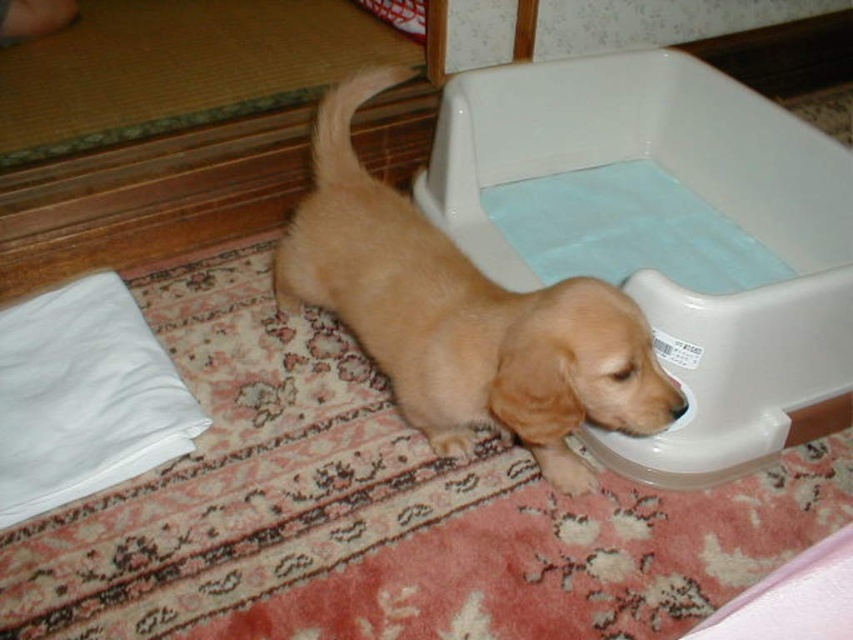
You need to place a toy that is 1.2 meters long in the space between the white plastic tub at lower right and the golden fur dog at center. Based on the scene, can the toy fit horizontally in that space?

The white plastic tub at lower right might be wider than golden fur dog at center, so the space between them may not be wide enough to fit a 1.2 meter long toy horizontally.

You are a delivery person with a package that is 1.8 meters long. You need to place it on the floor between the two points marked as point (747, 144) and another point. Is there enough space between them to fit the package without bending it?

The distance between the two points is 1.62 meters, which is shorter than the package length of 1.8 meters. Therefore, the package cannot be placed straight between them without bending.

You are a pet owner who wants to ensure your golden fur dog at center can easily access the white plastic tub at lower right for drinking water. Based on their heights, is the tub likely too tall for the dog to drink from comfortably?

The white plastic tub at lower right is not as tall as the golden fur dog at center, so the dog should be able to drink comfortably without difficulty.